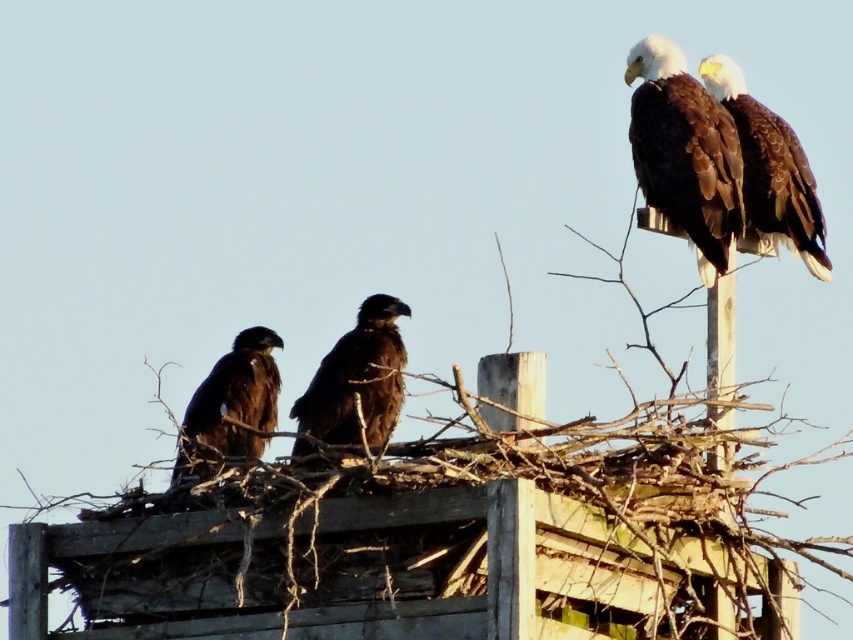
Question: Which object is closer to the camera taking this photo?

Choices:
 (A) brown feathered eagle at upper right
 (B) dark brown feathers at upper right
 (C) brown feathered eagle at center
 (D) dark brown feathers at center

Answer: (C)

Question: Which point is farther to the camera?

Choices:
 (A) dark brown feathers at center
 (B) dark brown feathers at upper right
 (C) brown feathered eagle at center

Answer: (A)

Question: Among these points, which one is nearest to the camera?

Choices:
 (A) (379, 332)
 (B) (251, 410)
 (C) (660, 92)

Answer: (C)

Question: Does brown feathered eagle at upper right appear on the left side of brown feathered eagle at center?

Choices:
 (A) yes
 (B) no

Answer: (B)

Question: Is brown feathered eagle at upper right wider than dark brown feathers at center?

Choices:
 (A) yes
 (B) no

Answer: (A)

Question: Observing the image, what is the correct spatial positioning of dark brown feathers at upper right in reference to dark brown feathers at center?

Choices:
 (A) left
 (B) right

Answer: (B)